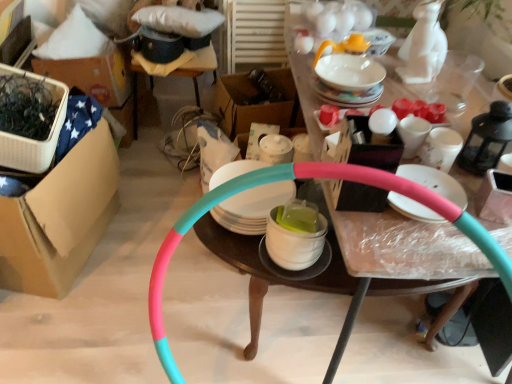
Locate an element on the screen. Image resolution: width=512 pixels, height=384 pixels. vacant position to the left of white glossy bowl at center, the 8th tableware viewed from the top is located at coordinates (243, 253).